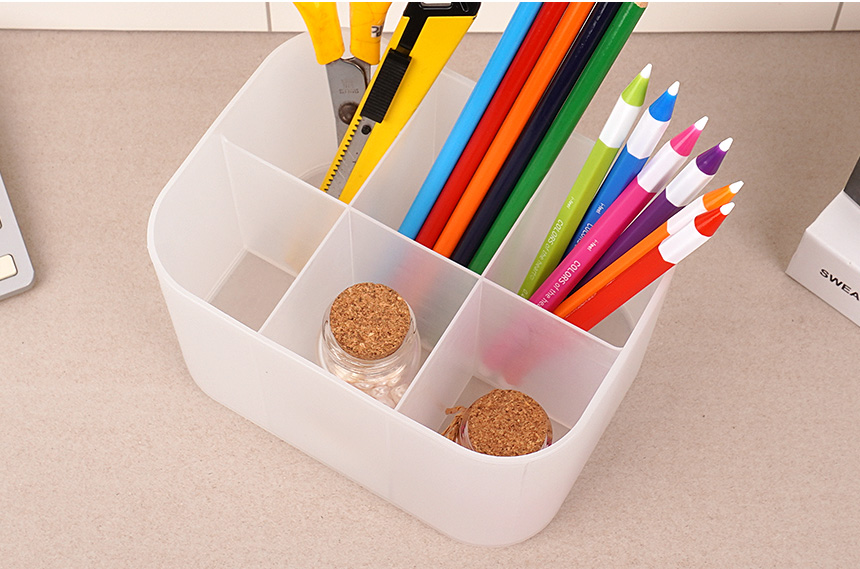
Find the location of `pens`. pens is located at coordinates (672, 242), (679, 218), (679, 191), (664, 166), (642, 144), (617, 131).